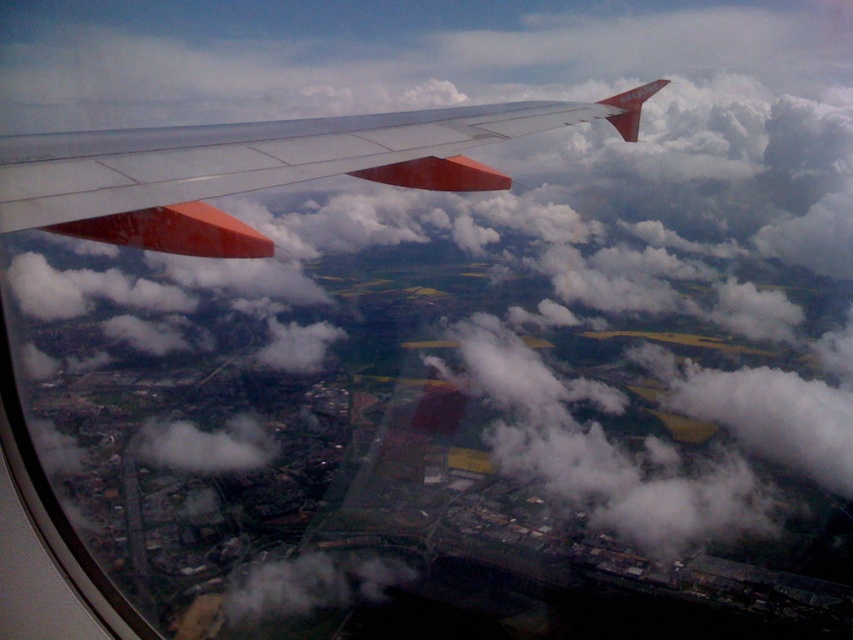
Does white fluffy cloud at lower center lie behind white fluffy cloud at lower left?

No, white fluffy cloud at lower center is in front of white fluffy cloud at lower left.

Is point (415, 557) behind point (231, 460)?

No, (415, 557) is closer to viewer.

Where is `white fluffy cloud at lower center`? This screenshot has height=640, width=853. white fluffy cloud at lower center is located at coordinates tap(312, 592).

Is matte white wing at upper left below white fluffy cloud at lower center?

No, matte white wing at upper left is not below white fluffy cloud at lower center.

Is matte white wing at upper left shorter than white fluffy cloud at lower center?

Correct, matte white wing at upper left is not as tall as white fluffy cloud at lower center.

Does point (635, 115) lie behind point (326, 560)?

No, (635, 115) is closer to viewer.

Find the location of a particular element. This screenshot has height=640, width=853. matte white wing at upper left is located at coordinates (259, 168).

Looking at this image, is the position of matte white wing at upper left less distant than that of white fluffy cloud at lower left?

That is True.

Is matte white wing at upper left positioned behind white fluffy cloud at lower left?

That is False.

What do you see at coordinates (259, 168) in the screenshot? I see `matte white wing at upper left` at bounding box center [259, 168].

Where is `matte white wing at upper left`? This screenshot has width=853, height=640. matte white wing at upper left is located at coordinates (259, 168).